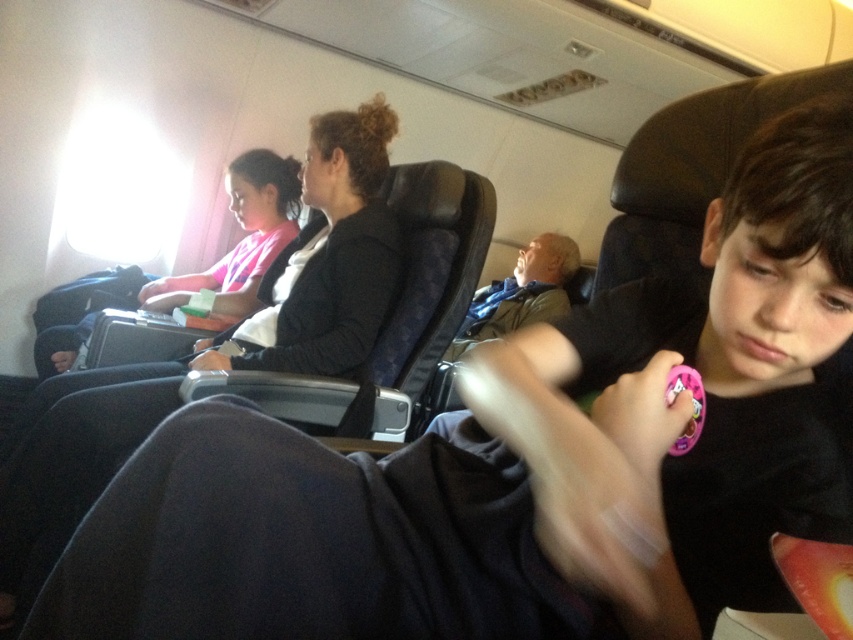
Question: Is pink fabric shirt at left positioned behind pink plastic toy at lower right?

Choices:
 (A) no
 (B) yes

Answer: (B)

Question: Is pink fabric shirt at left to the left of pink plastic toy at lower right from the viewer's perspective?

Choices:
 (A) no
 (B) yes

Answer: (B)

Question: Which of the following is the closest to the observer?

Choices:
 (A) pink fabric shirt at left
 (B) pink plastic toy at lower right

Answer: (B)

Question: Which object is farther from the camera taking this photo?

Choices:
 (A) pink plastic toy at lower right
 (B) pink fabric shirt at left

Answer: (B)

Question: Is pink fabric shirt at left above pink plastic toy at lower right?

Choices:
 (A) no
 (B) yes

Answer: (B)